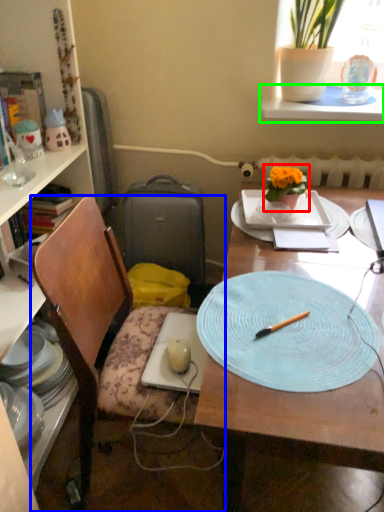
Question: Based on their relative distances, which object is farther from houseplant (highlighted by a red box)? Choose from chair (highlighted by a blue box) and window sill (highlighted by a green box).

Choices:
 (A) chair
 (B) window sill

Answer: (A)